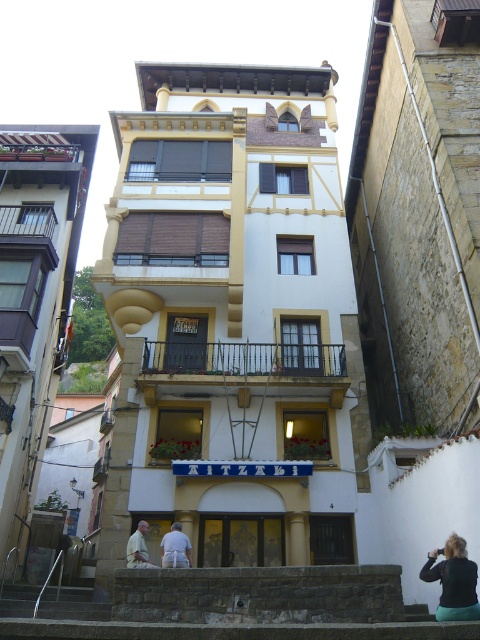
Is black fabric at lower right to the left of light brown leather jacket at center from the viewer's perspective?

Incorrect, black fabric at lower right is not on the left side of light brown leather jacket at center.

Is black fabric at lower right above light brown leather jacket at center?

Yes, black fabric at lower right is above light brown leather jacket at center.

Measure the distance between black fabric at lower right and camera.

black fabric at lower right is 13.39 meters from camera.

Where is `black fabric at lower right`? Image resolution: width=480 pixels, height=640 pixels. black fabric at lower right is located at coordinates (454, 580).

Is white cotton shirt at center wider than light brown leather jacket at center?

Indeed, white cotton shirt at center has a greater width compared to light brown leather jacket at center.

Who is higher up, white cotton shirt at center or light brown leather jacket at center?

Positioned higher is white cotton shirt at center.

Does point (170, 541) come farther from viewer compared to point (147, 564)?

Yes, point (170, 541) is behind point (147, 564).

Identify the location of white cotton shirt at center. (176, 548).

Does black fabric at lower right have a greater width compared to white cotton shirt at center?

Indeed, black fabric at lower right has a greater width compared to white cotton shirt at center.

Which of these two, black fabric at lower right or white cotton shirt at center, stands shorter?

Standing shorter between the two is white cotton shirt at center.

Is point (469, 573) closer to camera compared to point (168, 554)?

That is True.

Image resolution: width=480 pixels, height=640 pixels. Identify the location of black fabric at lower right. (454, 580).